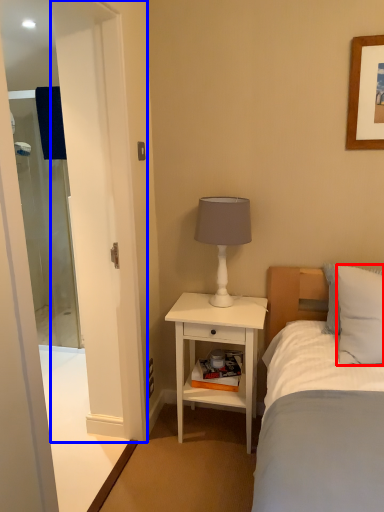
Question: Among these objects, which one is farthest to the camera, pillow (highlighted by a red box) or screen door (highlighted by a blue box)?

Choices:
 (A) pillow
 (B) screen door

Answer: (A)